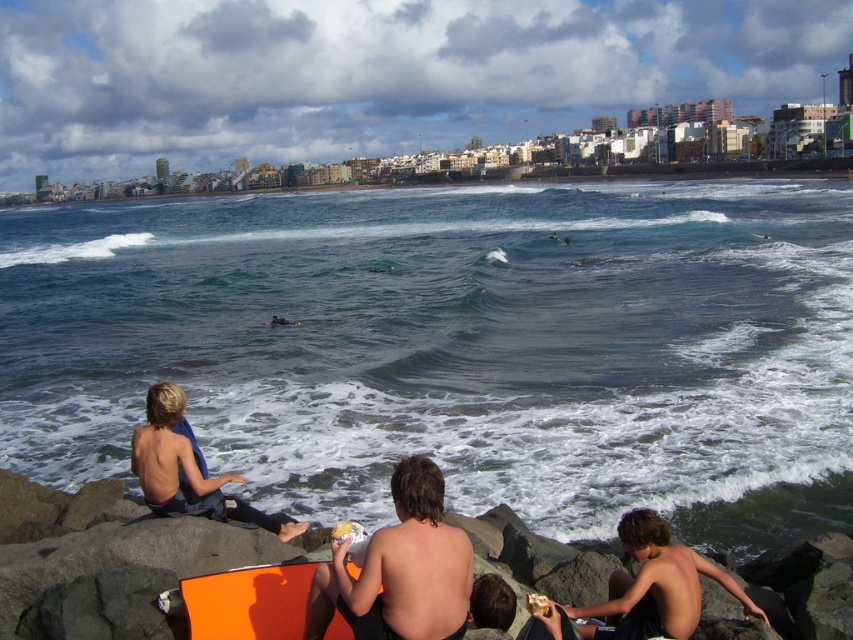
Who is higher up, clear blue water at center or shiny orange surfboard at center?

clear blue water at center is above.

Is clear blue water at center to the right of shiny orange surfboard at center from the viewer's perspective?

No, clear blue water at center is not to the right of shiny orange surfboard at center.

The height and width of the screenshot is (640, 853). Describe the element at coordinates (456, 348) in the screenshot. I see `clear blue water at center` at that location.

Where is `clear blue water at center`? clear blue water at center is located at coordinates (456, 348).

Is clear blue water at center behind blue fabric surfer at lower left?

Yes, it is.

Is clear blue water at center to the left of blue fabric surfer at lower left from the viewer's perspective?

Incorrect, clear blue water at center is not on the left side of blue fabric surfer at lower left.

Who is more distant from viewer, (712, 221) or (215, 492)?

Positioned behind is point (712, 221).

Find the location of a particular element. This screenshot has width=853, height=640. clear blue water at center is located at coordinates (456, 348).

Which is more to the left, shiny orange surfboard at center or blue fabric surfer at lower left?

blue fabric surfer at lower left is more to the left.

Who is higher up, shiny orange surfboard at center or blue fabric surfer at lower left?

blue fabric surfer at lower left is higher up.

Identify the location of shiny orange surfboard at center. This screenshot has width=853, height=640. (405, 566).